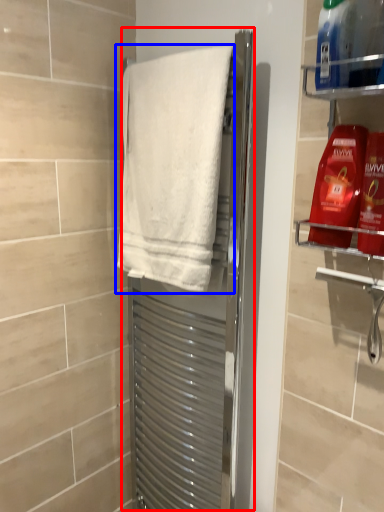
Question: Which object is further to the camera taking this photo, screen door (highlighted by a red box) or towel (highlighted by a blue box)?

Choices:
 (A) screen door
 (B) towel

Answer: (A)